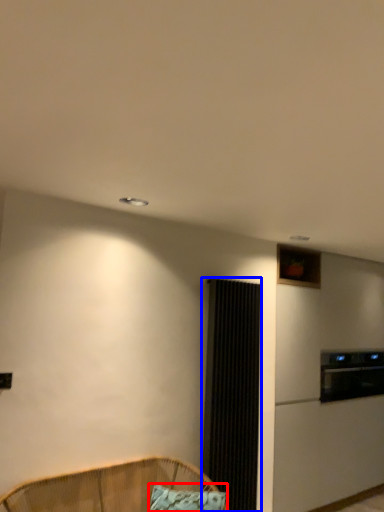
Question: Which of the following is the closest to the observer, pillow (highlighted by a red box) or screen door (highlighted by a blue box)?

Choices:
 (A) pillow
 (B) screen door

Answer: (A)